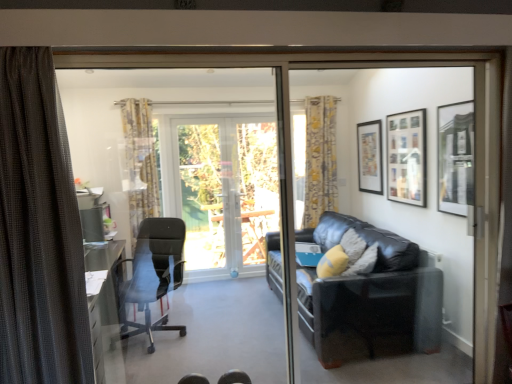
Question: Is matte black picture frame at upper right, positioned as the 1th picture frame in front-to-back order, shorter than transparent glass screen door at center, which is counted as the second screen door, starting from the right?

Choices:
 (A) no
 (B) yes

Answer: (B)

Question: Is transparent glass screen door at center, the first screen door in the left-to-right sequence, completely or partially inside matte black picture frame at upper right, the third picture frame in the back-to-front sequence?

Choices:
 (A) no
 (B) yes

Answer: (A)

Question: From a real-world perspective, is matte black picture frame at upper right, positioned as the 1th picture frame in front-to-back order, located higher than transparent glass screen door at center, the first screen door in the left-to-right sequence?

Choices:
 (A) yes
 (B) no

Answer: (A)

Question: Considering the relative sizes of matte black picture frame at upper right, positioned as the 1th picture frame in front-to-back order, and transparent glass screen door at center, which is counted as the second screen door, starting from the right, in the image provided, is matte black picture frame at upper right, positioned as the 1th picture frame in front-to-back order, thinner than transparent glass screen door at center, which is counted as the second screen door, starting from the right,?

Choices:
 (A) yes
 (B) no

Answer: (A)

Question: Is matte black picture frame at upper right, the third picture frame in the back-to-front sequence, positioned far away from transparent glass screen door at center, which is counted as the second screen door, starting from the right?

Choices:
 (A) yes
 (B) no

Answer: (A)

Question: Does matte black picture frame at upper right, the third picture frame in the back-to-front sequence, touch transparent glass screen door at center, which is counted as the second screen door, starting from the right?

Choices:
 (A) no
 (B) yes

Answer: (A)

Question: Is yellow floral fabric curtain at left, the first curtain positioned from the left, beside yellow floral fabric curtain at upper right, the first curtain from the back?

Choices:
 (A) no
 (B) yes

Answer: (A)

Question: From the image's perspective, is yellow floral fabric curtain at left, marked as the 2th curtain in a front-to-back arrangement, above yellow floral fabric curtain at upper right, placed as the first curtain when sorted from right to left?

Choices:
 (A) yes
 (B) no

Answer: (B)

Question: Is the depth of yellow floral fabric curtain at left, which appears as the 2th curtain when viewed from the back, greater than that of yellow floral fabric curtain at upper right, the first curtain from the back?

Choices:
 (A) no
 (B) yes

Answer: (A)

Question: Is yellow floral fabric curtain at left, which appears as the 2th curtain when viewed from the back, located outside yellow floral fabric curtain at upper right, acting as the 3th curtain starting from the front?

Choices:
 (A) no
 (B) yes

Answer: (B)

Question: Is yellow floral fabric curtain at upper right, the first curtain from the back, completely or partially inside yellow floral fabric curtain at left, acting as the 3th curtain starting from the right?

Choices:
 (A) no
 (B) yes

Answer: (A)

Question: Can you confirm if yellow floral fabric curtain at left, the first curtain positioned from the left, is positioned to the right of yellow floral fabric curtain at upper right, the first curtain from the back?

Choices:
 (A) no
 (B) yes

Answer: (A)

Question: Is matte black picture frame at upper right, which is the 2th picture frame from back to front, at the left side of black leather couch at right, which is the first screen door from right to left?

Choices:
 (A) yes
 (B) no

Answer: (B)